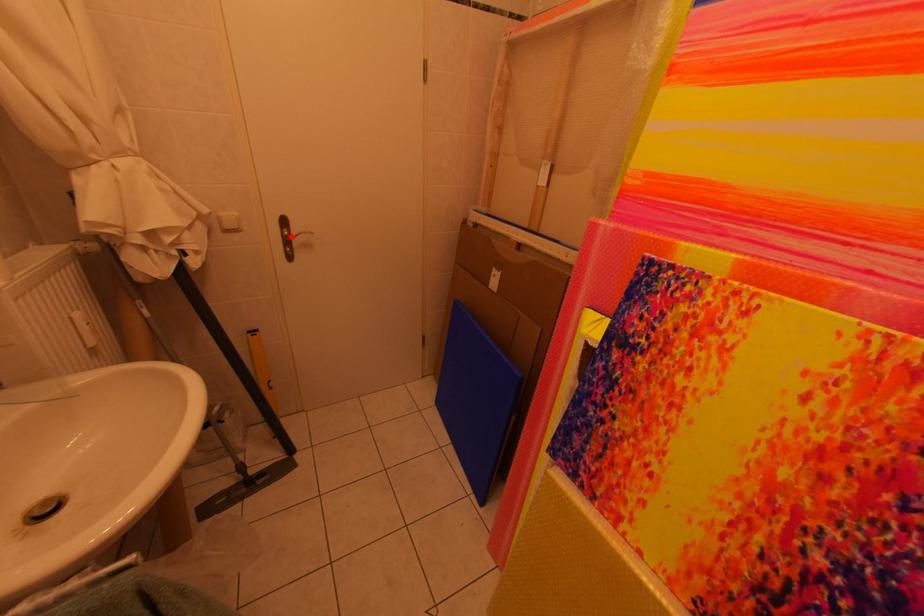
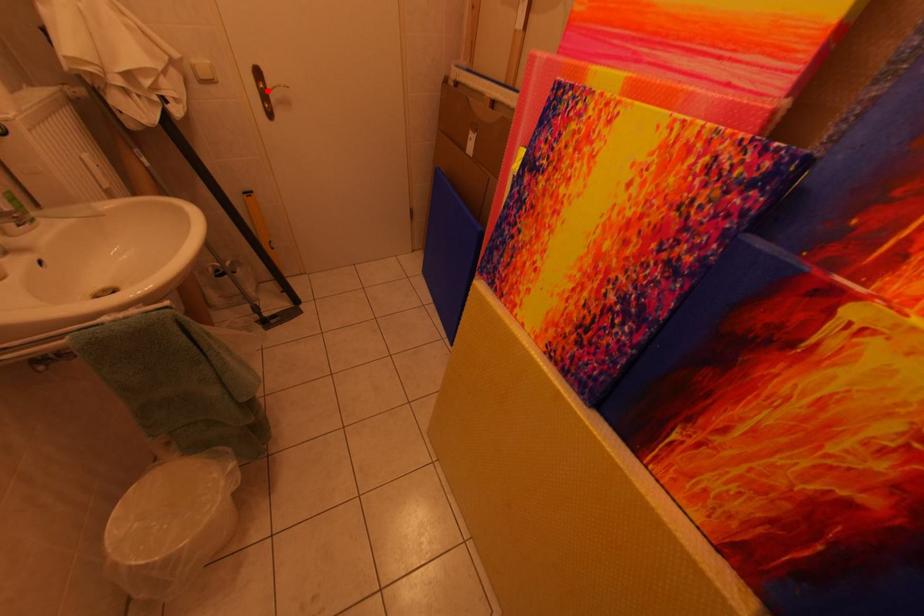
I am providing you with two images of the same scene from different viewpoints. A red point is marked on the first image and another point is marked on the second image. Is the marked point in image1 the same physical position as the marked point in image2?

Yes